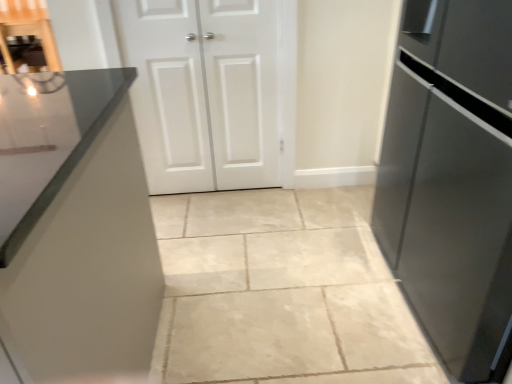
Question: Is satin black refrigerator at right inside or outside of white matte cabinet doors at center, which is the 2th door in right-to-left order?

Choices:
 (A) outside
 (B) inside

Answer: (A)

Question: From the image's perspective, relative to white matte cabinet doors at center, which is the 2th door in right-to-left order, is satin black refrigerator at right above or below?

Choices:
 (A) above
 (B) below

Answer: (B)

Question: Considering the real-world distances, which object is farthest from the white matte cabinet doors at center, which is the 2th door in right-to-left order?

Choices:
 (A) satin black refrigerator at right
 (B) white matte door at center, the second door viewed from the left

Answer: (A)

Question: Which is nearer to the white matte cabinet doors at center, which is the 2th door in right-to-left order?

Choices:
 (A) white matte door at center, the second door viewed from the left
 (B) satin black refrigerator at right

Answer: (A)